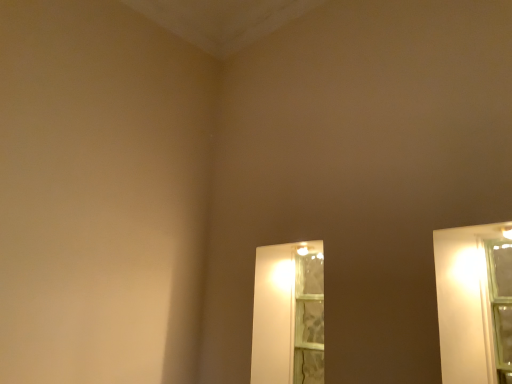
Question: Should I look upward or downward to see clear glass window at center?

Choices:
 (A) up
 (B) down

Answer: (B)